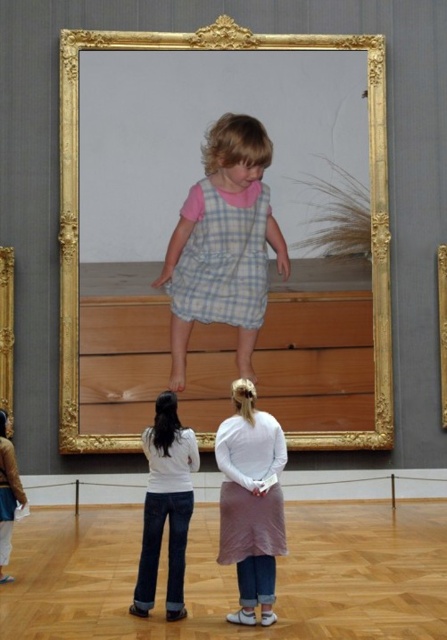
Question: Does gold ornate frame at upper left have a smaller size compared to goldmaterial/texturepicture frame at center?

Choices:
 (A) no
 (B) yes

Answer: (A)

Question: Can you confirm if light blue plaid dress at center is bigger than gold ornate frame at upper left?

Choices:
 (A) yes
 (B) no

Answer: (A)

Question: Which object appears closest to the camera in this image?

Choices:
 (A) goldmaterial/texturepicture frame at center
 (B) gold ornate frame at upper left
 (C) pink fabric dress at lower center

Answer: (C)

Question: Considering the real-world distances, which object is closest to the pink fabric dress at lower center?

Choices:
 (A) checkered fabric dress at center
 (B) gold ornate frame at upper left

Answer: (A)

Question: Where is gold ornate frame at center located in relation to checkered fabric dress at center in the image?

Choices:
 (A) above
 (B) below

Answer: (A)

Question: Which object appears closest to the camera in this image?

Choices:
 (A) gold ornate frame at center
 (B) pink fabric dress at lower center

Answer: (B)